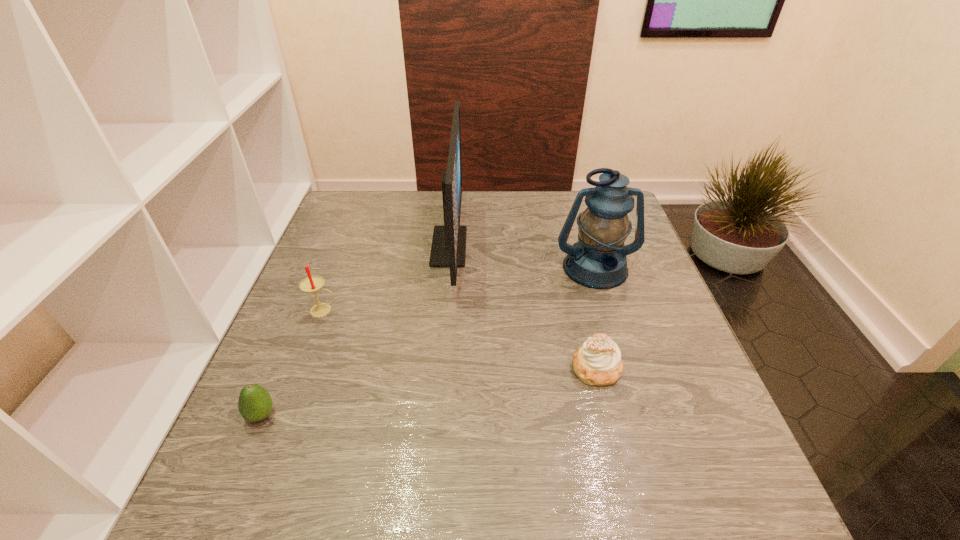
At what (x,y) coordinates should I click in order to perform the action: click on free point between the lantern and the pastry. Please return your answer as a coordinate pair (x, y). The height and width of the screenshot is (540, 960). Looking at the image, I should click on (596, 318).

Point out which object is positioned as the nearest to the third shortest object. Please provide its 2D coordinates. Your answer should be formatted as a tuple, i.e. [(x, y)], where the tuple contains the x and y coordinates of a point satisfying the conditions above.

[(448, 249)]

Identify which object is the third nearest to the pastry. Please provide its 2D coordinates. Your answer should be formatted as a tuple, i.e. [(x, y)], where the tuple contains the x and y coordinates of a point satisfying the conditions above.

[(310, 284)]

Locate an element on the screen. This screenshot has height=540, width=960. vacant space that satisfies the following two spatial constraints: 1. on the back side of the candle; 2. on the right side of the avocado is located at coordinates (305, 310).

I want to click on free point that satisfies the following two spatial constraints: 1. on the back side of the avocado; 2. on the left side of the candle, so click(x=305, y=310).

This screenshot has height=540, width=960. Identify the location of free space that satisfies the following two spatial constraints: 1. on the screen side of the fourth farthest object; 2. on the right side of the third object from right to left. (439, 368).

Where is `vacant point that satisfies the following two spatial constraints: 1. on the screen side of the computer monitor; 2. on the left side of the second nearest object`? The height and width of the screenshot is (540, 960). vacant point that satisfies the following two spatial constraints: 1. on the screen side of the computer monitor; 2. on the left side of the second nearest object is located at coordinates (439, 368).

Find the location of a particular element. free region that satisfies the following two spatial constraints: 1. on the screen side of the computer monitor; 2. on the left side of the second nearest object is located at coordinates (439, 368).

Locate an element on the screen. vacant space that satisfies the following two spatial constraints: 1. on the front side of the candle; 2. on the left side of the pastry is located at coordinates (302, 368).

Where is `free spot that satisfies the following two spatial constraints: 1. on the screen side of the third object from left to right; 2. on the right side of the pastry`? This screenshot has height=540, width=960. free spot that satisfies the following two spatial constraints: 1. on the screen side of the third object from left to right; 2. on the right side of the pastry is located at coordinates (439, 368).